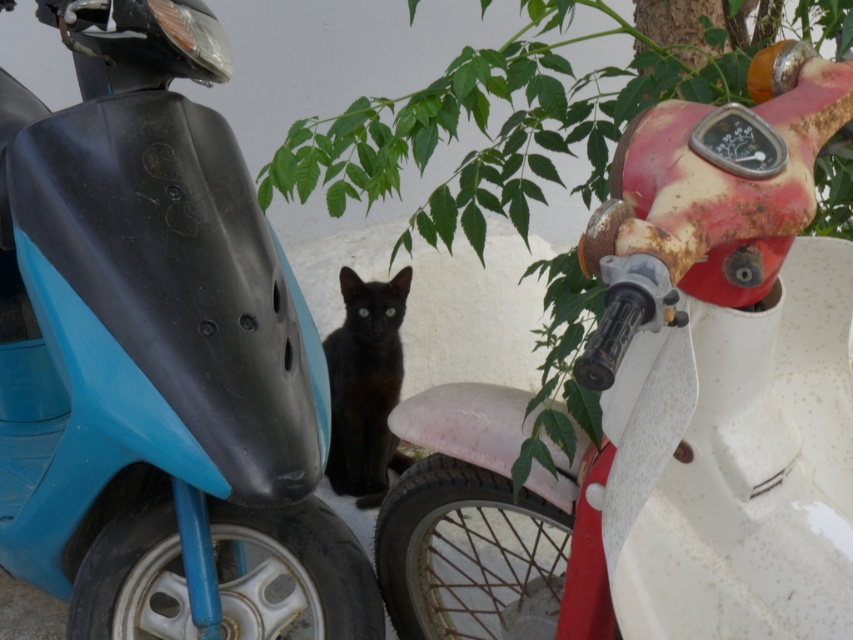
You are a delivery person who needs to park your scooter in the exact spot where the rusty white motorcycle at right is currently parked. What are the coordinates of the parking spot you should aim for?

The coordinates of the parking spot for the rusty white motorcycle at right are at point (662, 406).

You are standing in front of two scooters with a kitten between them. You notice two points marked on the ground. The first point is at coordinate point (695, 280) and the second at point (265, 284). If you want to place a small toy for the kitten, which point should you choose so that it is closer to you?

You should place the small toy at point (695, 280) because it is closer to the viewer than point (265, 284).

Based on the photo, you are a delivery person who needs to pass between the two scooters to reach your delivery location. The path between the rusty white motorcycle at right and the other scooter is 1.10 meters wide. If your delivery cart is 1.0 meter wide, can you safely navigate through this space?

Result: The distance between the rusty white motorcycle at right and the camera is 1.10 meters, so yes, the delivery cart can safely pass through the space since it is wider than the cart.